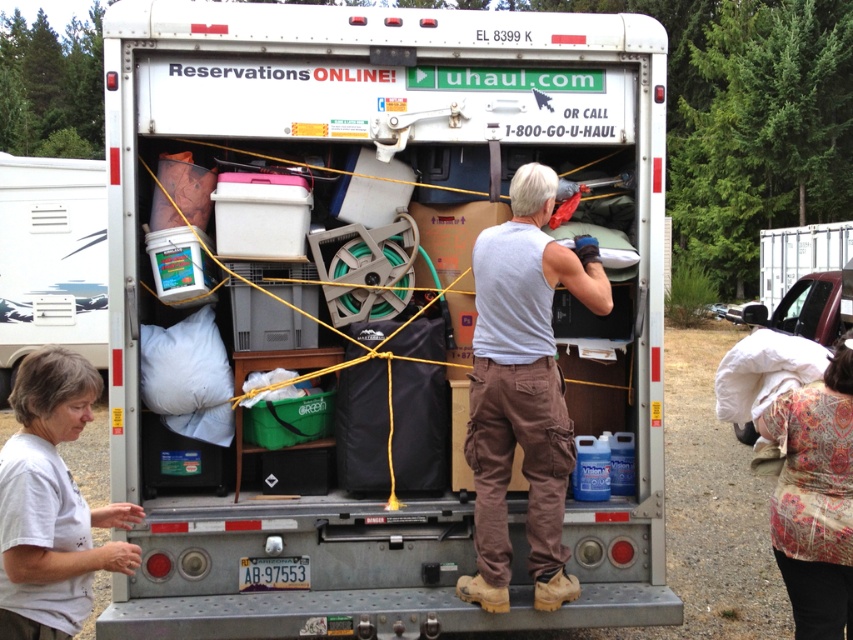
Is point (637, 504) positioned before point (79, 390)?

That is False.

Which is in front, point (576, 577) or point (33, 406)?

Point (33, 406) is more forward.

Is point (260, 259) positioned in front of point (138, 563)?

No.

The image size is (853, 640). I want to click on metallic silver truck at center, so click(x=386, y=300).

Is point (20, 582) closer to camera compared to point (821, 440)?

Yes, it is.

Between white cotton shirt at lower left and floral-patterned fabric at lower right, which one appears on the right side from the viewer's perspective?

floral-patterned fabric at lower right is more to the right.

This screenshot has height=640, width=853. I want to click on white cotton shirt at lower left, so click(51, 504).

Where is `white cotton shirt at lower left`? Image resolution: width=853 pixels, height=640 pixels. white cotton shirt at lower left is located at coordinates (51, 504).

Which is above, metallic silver truck at center or floral-patterned fabric at lower right?

metallic silver truck at center is higher up.

Can you confirm if metallic silver truck at center is positioned above floral-patterned fabric at lower right?

Yes.

Which is in front, point (599, 356) or point (822, 378)?

Point (822, 378) is in front.

Where is `metallic silver truck at center`? This screenshot has width=853, height=640. metallic silver truck at center is located at coordinates (386, 300).